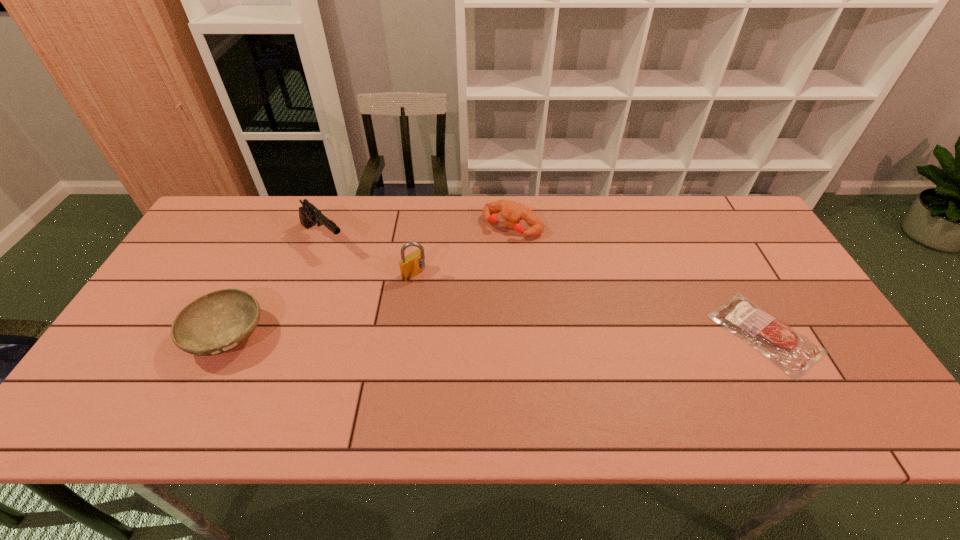
Where is `bowl`? Image resolution: width=960 pixels, height=540 pixels. bowl is located at coordinates coord(215,323).

Image resolution: width=960 pixels, height=540 pixels. I want to click on the rightmost object, so click(x=795, y=354).

The height and width of the screenshot is (540, 960). In order to click on the shortest object in this screenshot , I will do [x=795, y=354].

Identify the location of padlock. (410, 266).

Identify the location of the third object from left to right. (410, 266).

Where is `gun`? The width and height of the screenshot is (960, 540). gun is located at coordinates (309, 215).

You are a GUI agent. You are given a task and a screenshot of the screen. Output one action in this format:
    pyautogui.click(x=<x>, y=<y>)
    Task: Click on the puncher
    This screenshot has width=960, height=540.
    Given the screenshot: What is the action you would take?
    pyautogui.click(x=512, y=212)

The image size is (960, 540). What are the coordinates of `vacant space situated on the right of the bowl` in the screenshot? It's located at pyautogui.click(x=343, y=336).

This screenshot has height=540, width=960. I want to click on free region located 0.210m on the back of the rightmost object, so click(714, 243).

This screenshot has height=540, width=960. I want to click on vacant space located on the side with the combination dials of the third farthest object, so click(x=471, y=315).